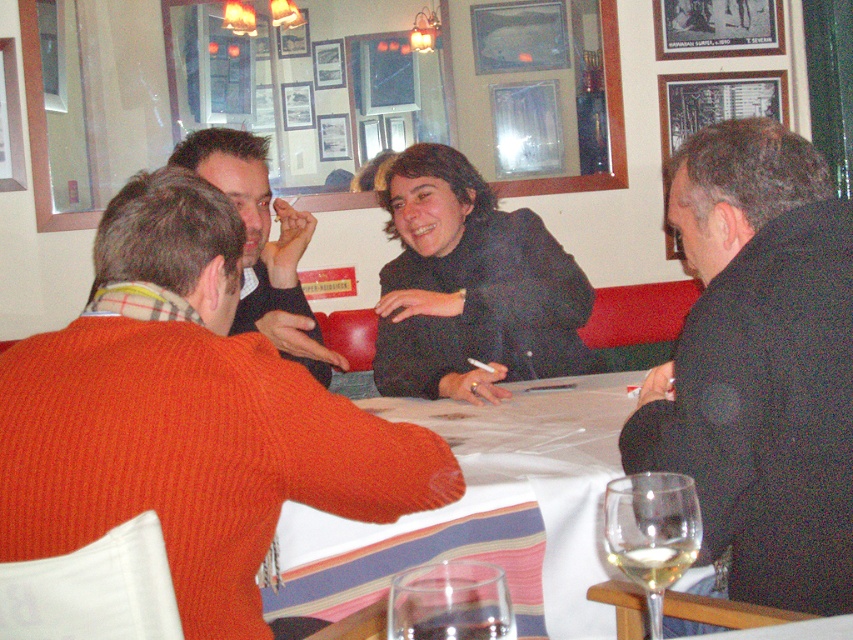
From the picture: You are standing at the point with coordinates point [187,416]. What object are you standing on?

You are standing on the black matte jacket at upper center.

You are a server at the restaurant and need to place a 16 inch wide dessert plate between the black matte jacket at upper center and the translucent glass at lower center. Can you fit it there?

The black matte jacket at upper center and translucent glass at lower center are 17.06 inches apart, so yes, the dessert plate can fit between them since the distance is greater than the plate width.

You are a server in a restaurant and need to place a new drink order on the table. The table has a black wool coat at right and a translucent glass at lower center. Which object should you avoid placing the drink near to prevent spills, considering their sizes?

You should avoid placing the drink near the black wool coat at right because its width is larger than the translucent glass at lower center, making it more likely to block access or cause spills if the drink is placed nearby.